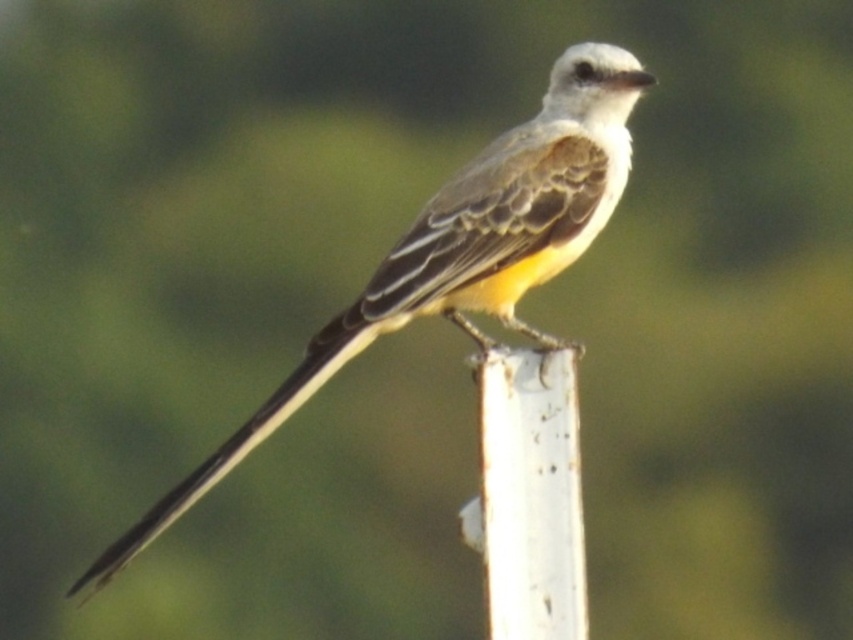
Can you confirm if yellow-brown feathers at center is positioned to the left of white weathered wood at center?

No, yellow-brown feathers at center is not to the left of white weathered wood at center.

Between yellow-brown feathers at center and white weathered wood at center, which one appears on the right side from the viewer's perspective?

yellow-brown feathers at center

Between point (566, 115) and point (526, 412), which one is positioned behind?

Positioned behind is point (566, 115).

Find the location of a particular element. yellow-brown feathers at center is located at coordinates (461, 252).